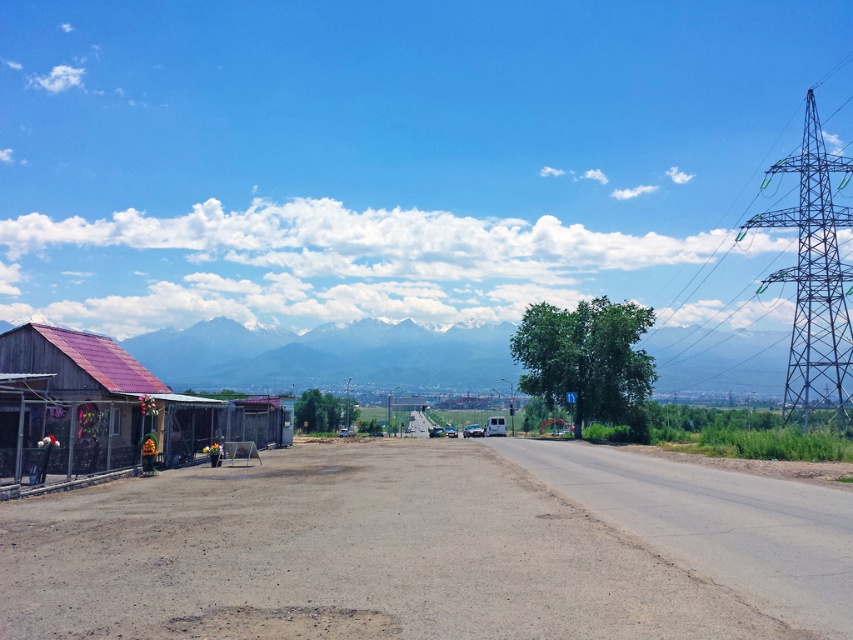
Does dusty asphalt road at lower left have a greater width compared to metallic corrugated roof hut at left?

Yes, dusty asphalt road at lower left is wider than metallic corrugated roof hut at left.

Is dusty asphalt road at lower left in front of metallic corrugated roof hut at left?

Yes.

Who is more forward, (517, 563) or (82, 429)?

Point (517, 563) is more forward.

Where is `dusty asphalt road at lower left`? dusty asphalt road at lower left is located at coordinates (431, 548).

Is white snow-covered mountain at center smaller than metallic corrugated roof hut at left?

No.

Does point (381, 339) come farther from viewer compared to point (6, 451)?

Yes, point (381, 339) is farther from viewer.

Find the location of a particular element. This screenshot has height=640, width=853. white snow-covered mountain at center is located at coordinates (328, 355).

Is dusty asphalt road at lower left wider than white snow-covered mountain at center?

Incorrect, dusty asphalt road at lower left's width does not surpass white snow-covered mountain at center's.

Measure the distance from dusty asphalt road at lower left to white snow-covered mountain at center.

dusty asphalt road at lower left is 191.84 meters from white snow-covered mountain at center.

Measure the distance between point [828,529] and camera.

Point [828,529] is 41.46 feet away from camera.

Find the location of `dusty asphalt road at lower left`. dusty asphalt road at lower left is located at coordinates (431, 548).